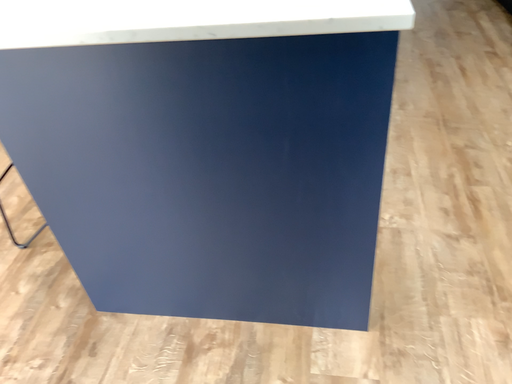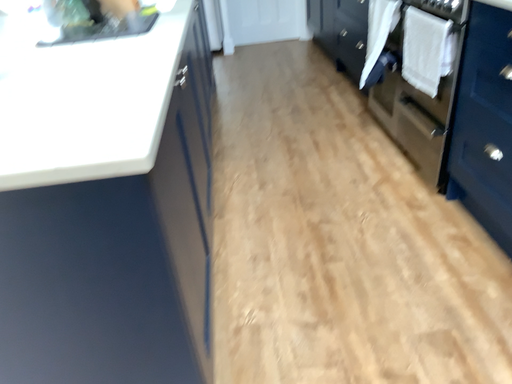
Question: Which way did the camera rotate in the video?

Choices:
 (A) rotated right
 (B) rotated left

Answer: (A)